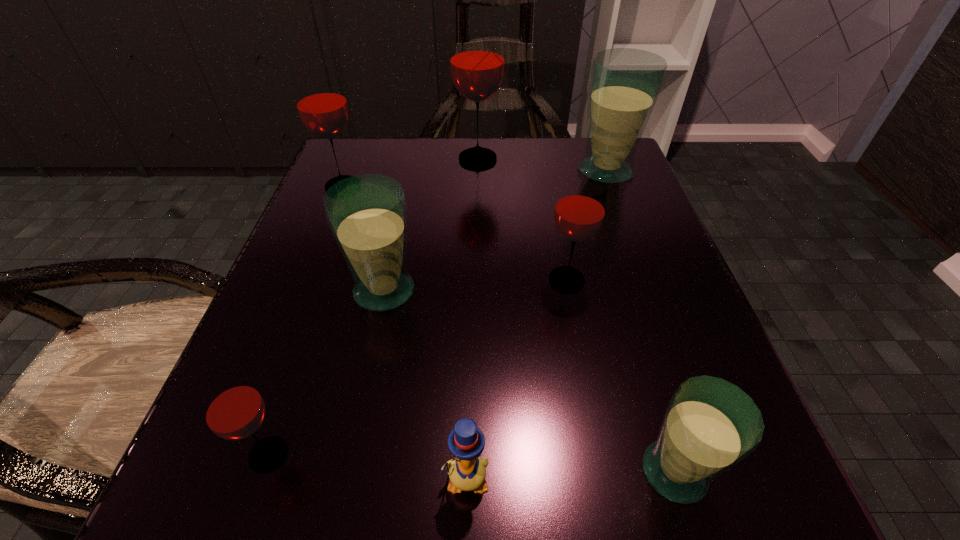
Where is `vacant space in between the smallest red glass and the duckling`? vacant space in between the smallest red glass and the duckling is located at coordinates (367, 467).

Find the location of a particular element. vacant region between the nearest blue glass and the second smallest red glass is located at coordinates (620, 376).

Locate an element on the screen. vacant region between the farthest blue glass and the sixth object from right to left is located at coordinates (495, 231).

Image resolution: width=960 pixels, height=540 pixels. In order to click on unoccupied area between the second red glass from right to left and the duckling in this screenshot , I will do `click(471, 319)`.

This screenshot has width=960, height=540. Identify the location of free point between the third nearest red glass and the smallest red glass. (305, 321).

At what (x,y) coordinates should I click in order to perform the action: click on empty space between the biggest blue glass and the smallest red glass. Please return your answer as a coordinate pair (x, y). Looking at the image, I should click on (437, 313).

Identify the location of free spot between the yellow duckling and the tallest glass. (471, 319).

Where is `free space between the smallest blue glass and the farthest blue glass`? free space between the smallest blue glass and the farthest blue glass is located at coordinates (640, 321).

You are a GUI agent. You are given a task and a screenshot of the screen. Output one action in this format:
    pyautogui.click(x=<x>, y=<y>)
    Task: Click on the unoccupied area between the third nearest red glass and the biggest blue glass
    The width and height of the screenshot is (960, 540).
    Given the screenshot: What is the action you would take?
    pyautogui.click(x=474, y=179)

I want to click on object that stands as the closest to the second farthest red glass, so click(477, 55).